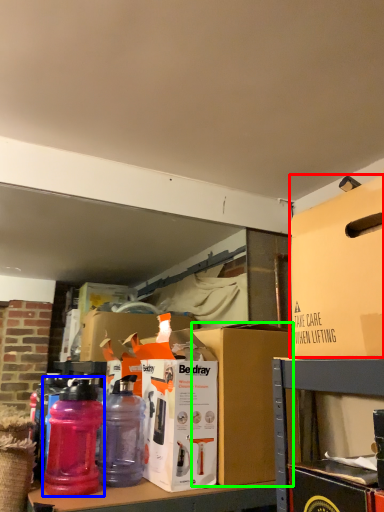
Question: Which object is positioned closest to box (highlighted by a red box)? Select from bottle (highlighted by a blue box) and storage box (highlighted by a green box).

Choices:
 (A) bottle
 (B) storage box

Answer: (B)